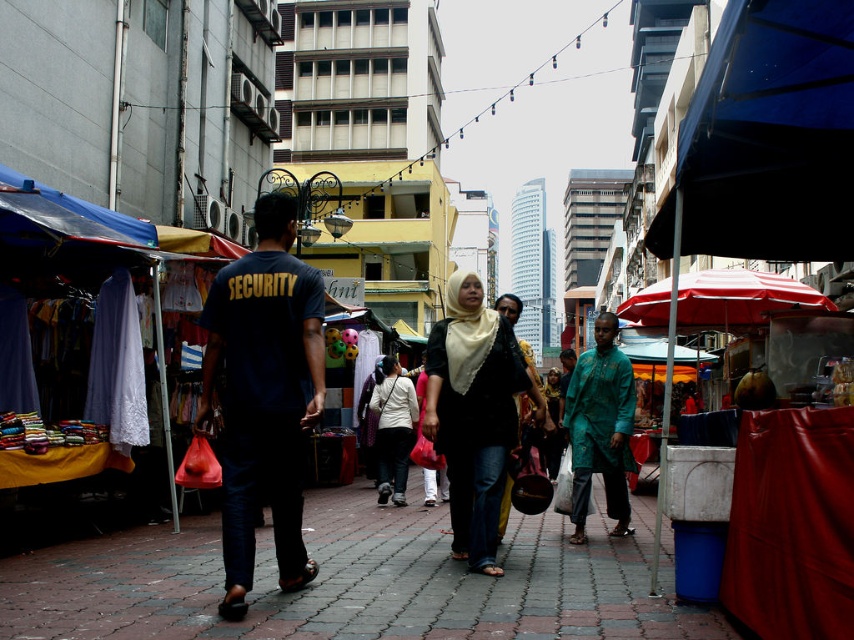
You are a photographer trying to capture both the dark blue cotton security shirt at center and the matte black hijab at center in a single frame. Which object should you focus on first to ensure both are in the frame?

The dark blue cotton security shirt at center is not as tall as the matte black hijab at center, so you should focus on the taller matte black hijab at center first to ensure both are in the frame.

You are standing at the security personnel on the left side of the cobblestone pathway. You want to reach the point marked as point (519, 378). Is the point (311, 372) located between you and your destination?

Yes, the point (311, 372) is located between you and your destination point (519, 378) because it is in front of the destination point from your starting position.